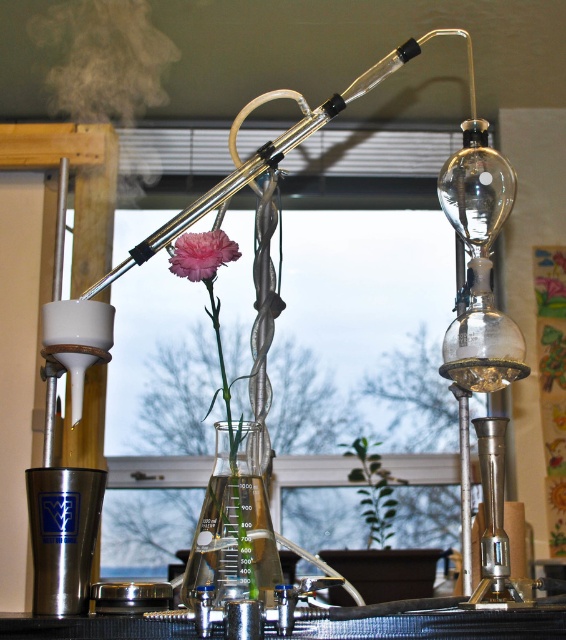
From the picture: In the laboratory scene, there is a transparent glass beaker at center and a pink matte flower at center. Which object is positioned to the right of the other?

The transparent glass beaker at center is to the right of the pink matte flower at center.

You are a researcher observing the laboratory setup. There are two points marked in the image at coordinates point (196, 576) and point (179, 244). Which point is closer to your eyes?

Point (179, 244) is closer to your eyes because it is nearer to the camera compared to point (196, 576), which is further away.